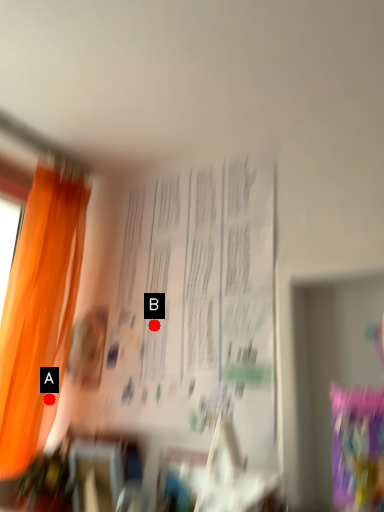
Question: Two points are circled on the image, labeled by A and B beside each circle. Which point is closer to the camera?

Choices:
 (A) A is closer
 (B) B is closer

Answer: (B)